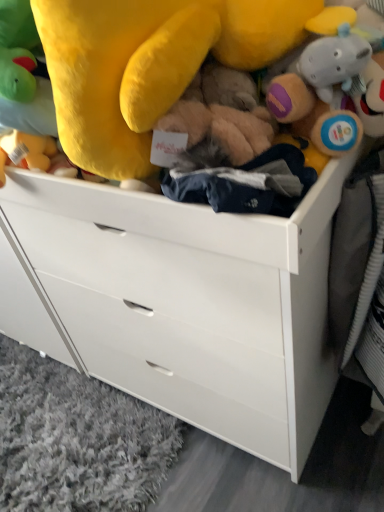
Question: From the image's perspective, relative to white matte chest of drawers at center, is soft plush toys at upper center above or below?

Choices:
 (A) below
 (B) above

Answer: (B)

Question: From a real-world perspective, relative to white matte chest of drawers at center, is soft plush toys at upper center vertically above or below?

Choices:
 (A) above
 (B) below

Answer: (A)

Question: Relative to white matte chest of drawers at center, is soft plush toys at upper center in front or behind?

Choices:
 (A) behind
 (B) front

Answer: (B)

Question: From a real-world perspective, is white matte chest of drawers at center positioned above or below soft plush toys at upper center?

Choices:
 (A) above
 (B) below

Answer: (B)

Question: Is white matte chest of drawers at center inside the boundaries of soft plush toys at upper center, or outside?

Choices:
 (A) outside
 (B) inside

Answer: (A)

Question: Considering their positions, is white matte chest of drawers at center located in front of or behind soft plush toys at upper center?

Choices:
 (A) behind
 (B) front

Answer: (A)

Question: From the image's perspective, relative to soft plush toys at upper center, is white matte chest of drawers at center above or below?

Choices:
 (A) above
 (B) below

Answer: (B)